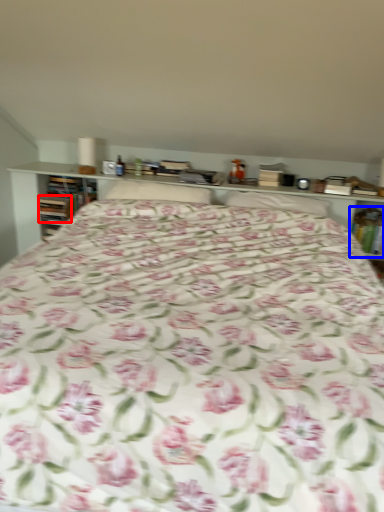
Question: Which point is further to the camera, book (highlighted by a red box) or book (highlighted by a blue box)?

Choices:
 (A) book
 (B) book

Answer: (A)